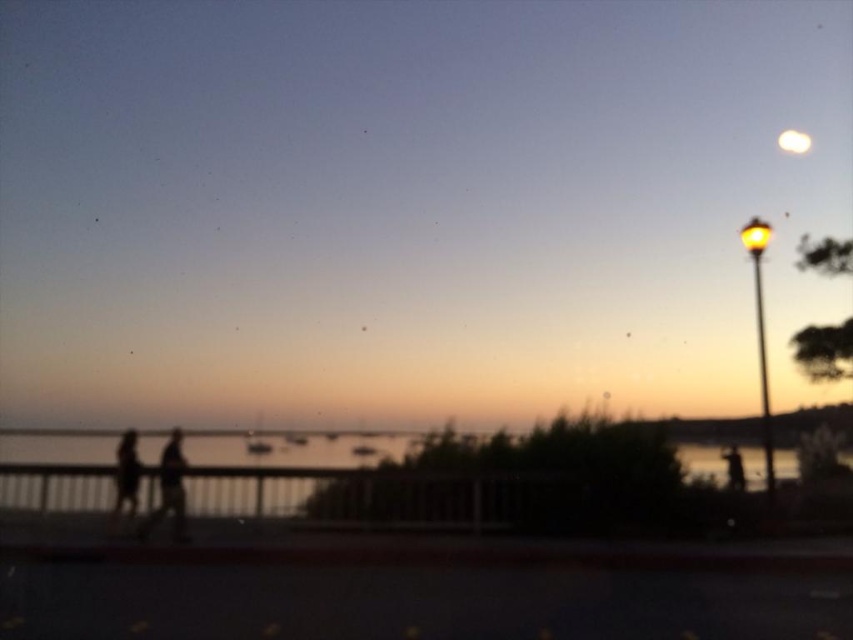
You are standing on the waterfront promenade and see the silhouette figures at center and the white glossy moon at upper right. Which object is positioned to the left of the other?

The silhouette figures at center are positioned to the left of the white glossy moon at upper right.